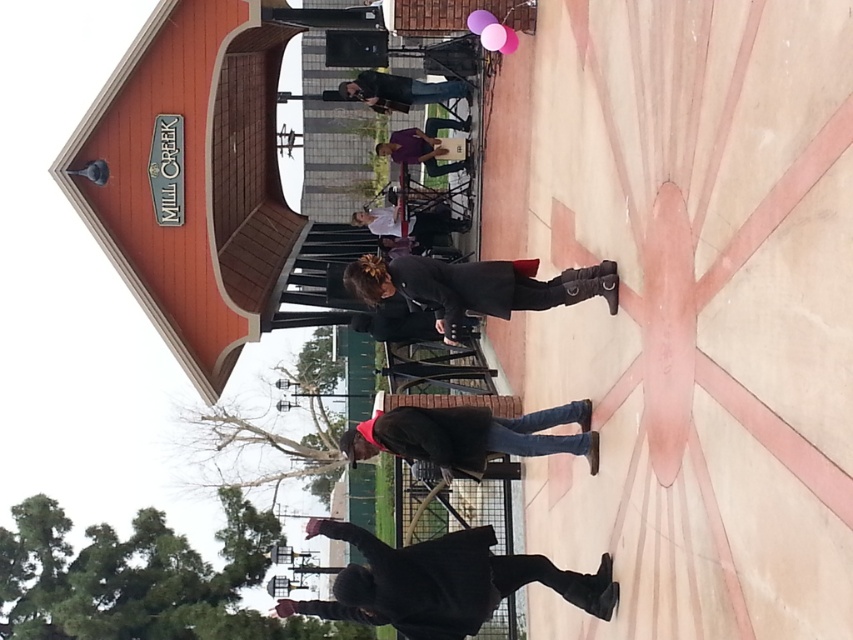
Looking at this image, you are standing at the Mill Creek building and want to walk to the pinkish circular design on the ground. Which point, point(520, 291) or point(512, 445), is closer to you?

Point(520, 291) is closer to you than point(512, 445).

You are standing at the edge of the pinkish pink circular design and see both the black matte skateboard at center and the black leather jacket at center. Which object is closer to your right side?

The black matte skateboard at center is to the right of the black leather jacket at center, so it is closer to your right side.

You are standing at the origin point of the coordinate system. The Mill Creek building is at coordinates 0.6, 0.7. Can you walk directly to the black leather boots at center without crossing the pinkish pink circular design on the ground?

The black leather boots at center is located at point (469,289). The Mill Creek building is at (596,384). Since the coordinates of the boots are closer to the origin than the building, you can walk directly to the boots without crossing the circular design unless the path intersects it. However, the exact path and the position of the circular design aren